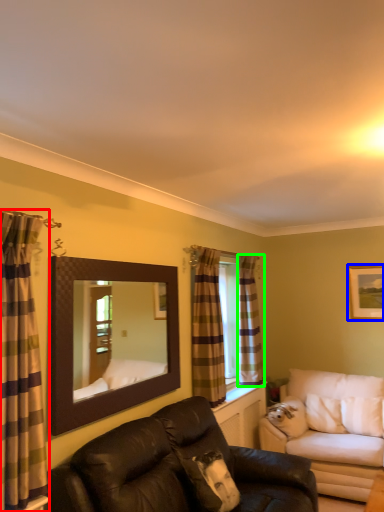
Question: Which object is the farthest from curtain (highlighted by a red box)? Choose among these: picture frame (highlighted by a blue box) or curtain (highlighted by a green box).

Choices:
 (A) picture frame
 (B) curtain

Answer: (A)